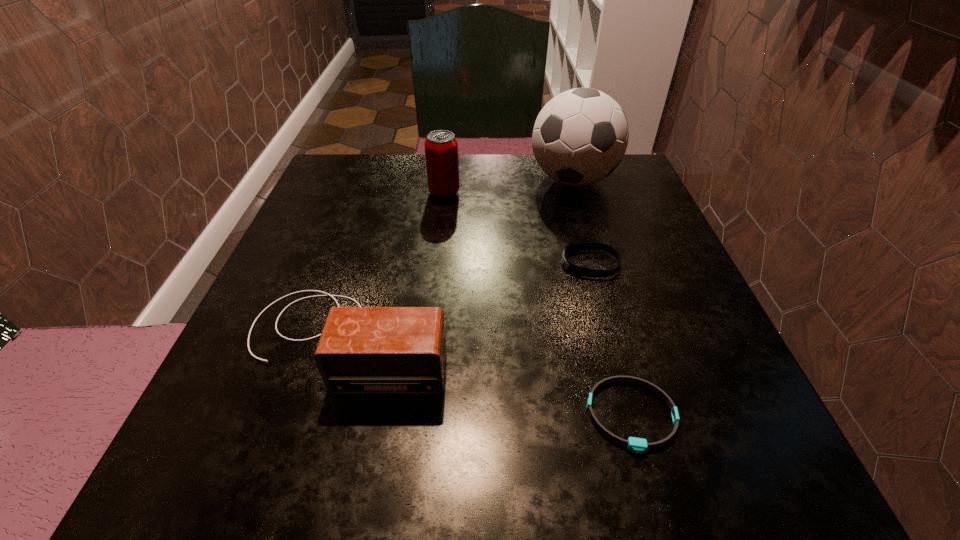
In the image, there is a desktop. At what (x,y) coordinates should I click in order to perform the action: click on free space at the far edge. Please return your answer as a coordinate pair (x, y). The image size is (960, 540). Looking at the image, I should click on (512, 169).

The image size is (960, 540). I want to click on free space at the near edge, so click(612, 485).

This screenshot has height=540, width=960. Identify the location of vacant space at the left edge of the desktop. (271, 279).

Find the location of a particular element. This screenshot has height=540, width=960. free region at the right edge of the desktop is located at coordinates (621, 212).

Find the location of a particular element. This screenshot has width=960, height=540. vacant region at the far left corner of the desktop is located at coordinates (330, 187).

In the image, there is a desktop. In order to click on vacant space at the near left corner in this screenshot , I will do `click(245, 468)`.

Identify the location of vacant area that lies between the fourth shortest object and the second shortest object. (517, 228).

Where is `free space that is in between the second shortest object and the shortest object`? Image resolution: width=960 pixels, height=540 pixels. free space that is in between the second shortest object and the shortest object is located at coordinates (611, 340).

Locate an element on the screen. The height and width of the screenshot is (540, 960). free spot between the shorter wristband and the second tallest object is located at coordinates (538, 304).

I want to click on free spot between the tallest object and the shortest object, so 602,298.